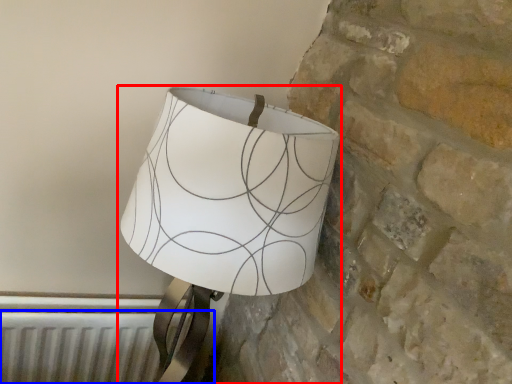
Question: Which point is closer to the camera, lamp (highlighted by a red box) or radiator (highlighted by a blue box)?

Choices:
 (A) lamp
 (B) radiator

Answer: (A)